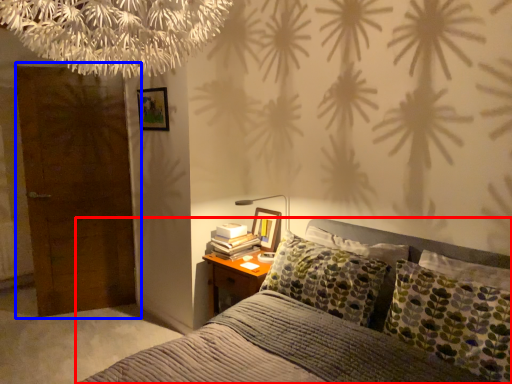
Question: Among these objects, which one is nearest to the camera, bed (highlighted by a red box) or door (highlighted by a blue box)?

Choices:
 (A) bed
 (B) door

Answer: (A)